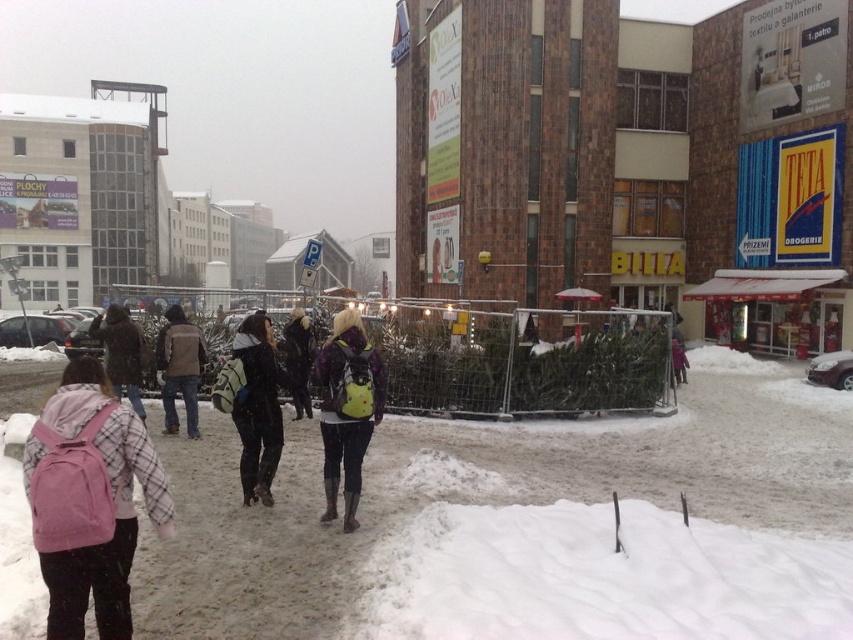
You are a photographer standing in the snowy urban scene. You want to take a photo of the brown leather jacket at center and the pink backpack at left. Which object should you focus on first if you want to capture both in the same frame without moving the camera?

The brown leather jacket at center is taller than the pink backpack at left, so you should focus on the brown leather jacket at center first to ensure both are in frame.

You are a photographer standing in the snowy urban scene. You want to take a photo of the brown leather jacket at center and the yellow backpack at center. Which object should you focus on first to ensure both are in focus?

You should focus on the brown leather jacket at center first since it is closer to the viewer than the yellow backpack at center. By focusing on the closer object, the yellow backpack at center will be within the depth of field, ensuring both are in focus.